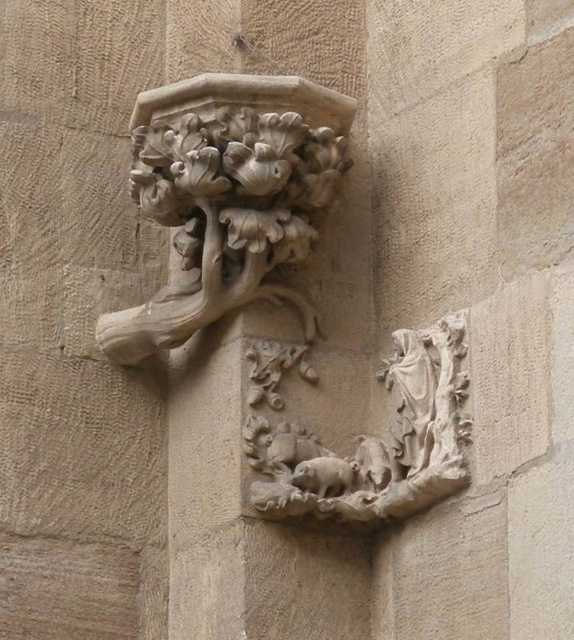
Question: Which point appears farthest from the camera in this image?

Choices:
 (A) (304, 378)
 (B) (197, 141)

Answer: (A)

Question: Is carved stone floral motif at upper center positioned in front of carved stone relief at center?

Choices:
 (A) no
 (B) yes

Answer: (A)

Question: Does carved stone floral motif at upper center appear on the right side of carved stone relief at center?

Choices:
 (A) yes
 (B) no

Answer: (B)

Question: Is carved stone floral motif at upper center thinner than carved stone relief at center?

Choices:
 (A) yes
 (B) no

Answer: (B)

Question: Which point is closer to the camera?

Choices:
 (A) carved stone floral motif at upper center
 (B) carved stone relief at center

Answer: (B)